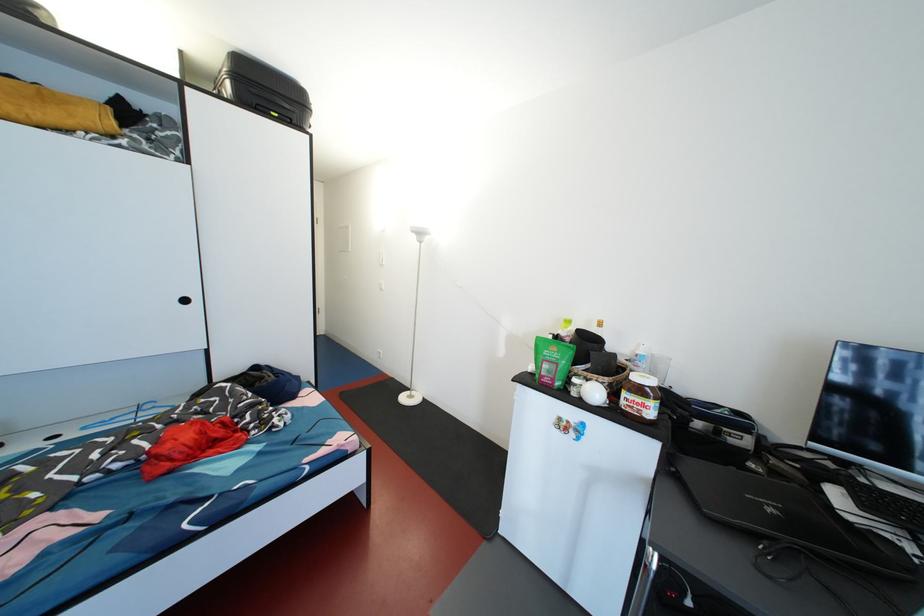
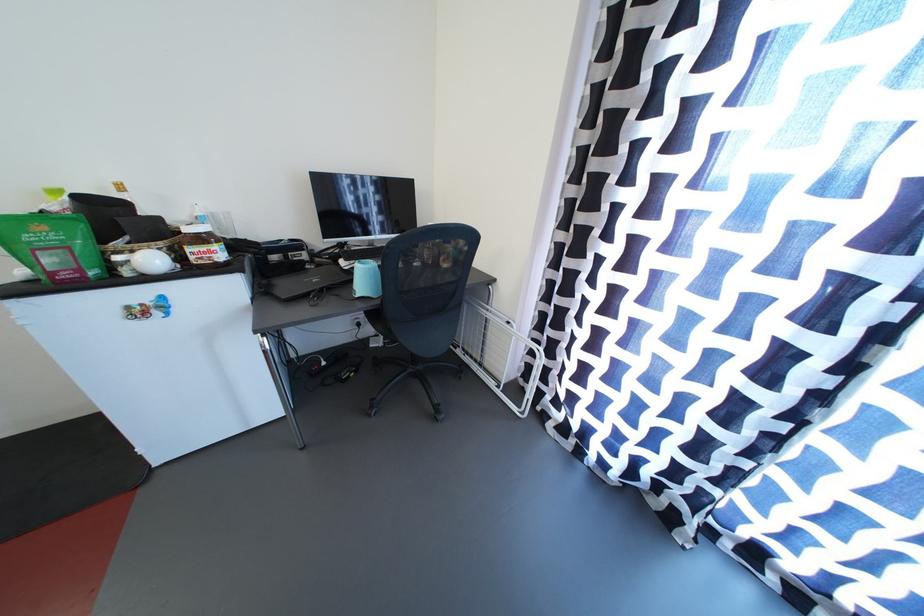
Locate, in the second image, the point that corresponds to (641,383) in the first image.

(195, 235)